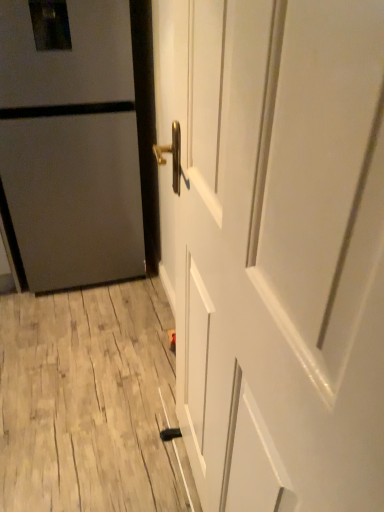
Where is `white glossy door at center, marked as the second door in a left-to-right arrangement`? white glossy door at center, marked as the second door in a left-to-right arrangement is located at coordinates (277, 247).

Describe the element at coordinates (277, 247) in the screenshot. This screenshot has height=512, width=384. I see `white glossy door at center, marked as the second door in a left-to-right arrangement` at that location.

What do you see at coordinates (71, 145) in the screenshot? I see `matte gray door at left, which appears as the second door when viewed from the front` at bounding box center [71, 145].

This screenshot has height=512, width=384. What are the coordinates of `matte gray door at left, which appears as the second door when viewed from the front` in the screenshot? It's located at (71, 145).

The height and width of the screenshot is (512, 384). What are the coordinates of `white glossy door at center, marked as the second door in a left-to-right arrangement` in the screenshot? It's located at (277, 247).

Considering the positions of objects matte gray door at left, which appears as the second door when viewed from the front, and white glossy door at center, the 2th door viewed from the back, in the image provided, who is more to the left, matte gray door at left, which appears as the second door when viewed from the front, or white glossy door at center, the 2th door viewed from the back,?

Positioned to the left is matte gray door at left, which appears as the second door when viewed from the front.

Considering the relative positions of matte gray door at left, the 1th door when ordered from left to right, and white glossy door at center, the 2th door viewed from the back, in the image provided, is matte gray door at left, the 1th door when ordered from left to right, behind white glossy door at center, the 2th door viewed from the back,?

Yes, matte gray door at left, the 1th door when ordered from left to right, is further from the viewer.

Considering the points (40, 48) and (204, 481), which point is behind, point (40, 48) or point (204, 481)?

Positioned behind is point (40, 48).

From the picture: From the image's perspective, between matte gray door at left, marked as the 1th door in a back-to-front arrangement, and white glossy door at center, the 2th door viewed from the back, who is located below?

white glossy door at center, the 2th door viewed from the back, is shown below in the image.

From a real-world perspective, does matte gray door at left, arranged as the 2th door when viewed from the right, sit lower than white glossy door at center, the 2th door viewed from the back?

Yes, from a real-world perspective, matte gray door at left, arranged as the 2th door when viewed from the right, is below white glossy door at center, the 2th door viewed from the back.

Which object is wider, matte gray door at left, arranged as the 2th door when viewed from the right, or white glossy door at center, which ranks as the first door in front-to-back order?

matte gray door at left, arranged as the 2th door when viewed from the right.

Does matte gray door at left, the 1th door when ordered from left to right, have a greater height compared to white glossy door at center, which ranks as the first door in front-to-back order?

In fact, matte gray door at left, the 1th door when ordered from left to right, may be shorter than white glossy door at center, which ranks as the first door in front-to-back order.

Considering the sizes of objects matte gray door at left, arranged as the 2th door when viewed from the right, and white glossy door at center, marked as the first door in a right-to-left arrangement, in the image provided, who is smaller, matte gray door at left, arranged as the 2th door when viewed from the right, or white glossy door at center, marked as the first door in a right-to-left arrangement,?

Smaller between the two is white glossy door at center, marked as the first door in a right-to-left arrangement.

Is matte gray door at left, the 1th door when ordered from left to right, completely or partially outside of white glossy door at center, which ranks as the first door in front-to-back order?

matte gray door at left, the 1th door when ordered from left to right, is positioned outside white glossy door at center, which ranks as the first door in front-to-back order.

Is matte gray door at left, which appears as the second door when viewed from the front, placed right next to white glossy door at center, marked as the second door in a left-to-right arrangement?

No.

Could you tell me if matte gray door at left, marked as the 1th door in a back-to-front arrangement, is turned towards white glossy door at center, marked as the second door in a left-to-right arrangement?

Yes, matte gray door at left, marked as the 1th door in a back-to-front arrangement, faces towards white glossy door at center, marked as the second door in a left-to-right arrangement.

Could you measure the distance between matte gray door at left, which appears as the second door when viewed from the front, and white glossy door at center, marked as the first door in a right-to-left arrangement?

matte gray door at left, which appears as the second door when viewed from the front, and white glossy door at center, marked as the first door in a right-to-left arrangement, are 1.04 meters apart.

In the image, there is a white glossy door at center, the 2th door viewed from the back. At what (x,y) coordinates should I click in order to perform the action: click on door below it (from a real-world perspective). Please return your answer as a coordinate pair (x, y). The image size is (384, 512). Looking at the image, I should click on (71, 145).

Is white glossy door at center, which ranks as the first door in front-to-back order, at the left side of matte gray door at left, the 1th door when ordered from left to right?

In fact, white glossy door at center, which ranks as the first door in front-to-back order, is to the right of matte gray door at left, the 1th door when ordered from left to right.

Is the depth of white glossy door at center, the 2th door viewed from the back, less than that of matte gray door at left, the 1th door when ordered from left to right?

Yes, white glossy door at center, the 2th door viewed from the back, is in front of matte gray door at left, the 1th door when ordered from left to right.

Is point (341, 426) closer to viewer compared to point (49, 123)?

That is True.

From the image's perspective, which is below, white glossy door at center, which ranks as the first door in front-to-back order, or matte gray door at left, the 1th door when ordered from left to right?

white glossy door at center, which ranks as the first door in front-to-back order, appears lower in the image.

From a real-world perspective, which object rests below the other?

In real-world perspective, matte gray door at left, which appears as the second door when viewed from the front, is lower.

Which of these two, white glossy door at center, which ranks as the first door in front-to-back order, or matte gray door at left, arranged as the 2th door when viewed from the right, is thinner?

white glossy door at center, which ranks as the first door in front-to-back order.

Considering the relative sizes of white glossy door at center, marked as the second door in a left-to-right arrangement, and matte gray door at left, which appears as the second door when viewed from the front, in the image provided, is white glossy door at center, marked as the second door in a left-to-right arrangement, shorter than matte gray door at left, which appears as the second door when viewed from the front,?

No.

Does white glossy door at center, marked as the second door in a left-to-right arrangement, have a larger size compared to matte gray door at left, marked as the 1th door in a back-to-front arrangement?

Incorrect, white glossy door at center, marked as the second door in a left-to-right arrangement, is not larger than matte gray door at left, marked as the 1th door in a back-to-front arrangement.

Is white glossy door at center, the 2th door viewed from the back, completely or partially outside of matte gray door at left, which appears as the second door when viewed from the front?

Absolutely, white glossy door at center, the 2th door viewed from the back, is external to matte gray door at left, which appears as the second door when viewed from the front.

Is white glossy door at center, which ranks as the first door in front-to-back order, in contact with matte gray door at left, which appears as the second door when viewed from the front?

white glossy door at center, which ranks as the first door in front-to-back order, and matte gray door at left, which appears as the second door when viewed from the front, are clearly separated.

Could you tell me if white glossy door at center, marked as the second door in a left-to-right arrangement, is turned towards matte gray door at left, arranged as the 2th door when viewed from the right?

No, white glossy door at center, marked as the second door in a left-to-right arrangement, is not aimed at matte gray door at left, arranged as the 2th door when viewed from the right.

What's the angular difference between white glossy door at center, which ranks as the first door in front-to-back order, and matte gray door at left, marked as the 1th door in a back-to-front arrangement,'s facing directions?

92.1 degrees.

The height and width of the screenshot is (512, 384). In order to click on door lying above the white glossy door at center, which ranks as the first door in front-to-back order (from the image's perspective) in this screenshot , I will do `click(71, 145)`.

The height and width of the screenshot is (512, 384). In order to click on door that appears in front of the matte gray door at left, the 1th door when ordered from left to right in this screenshot , I will do [x=277, y=247].

The width and height of the screenshot is (384, 512). I want to click on door behind the white glossy door at center, the 2th door viewed from the back, so click(x=71, y=145).